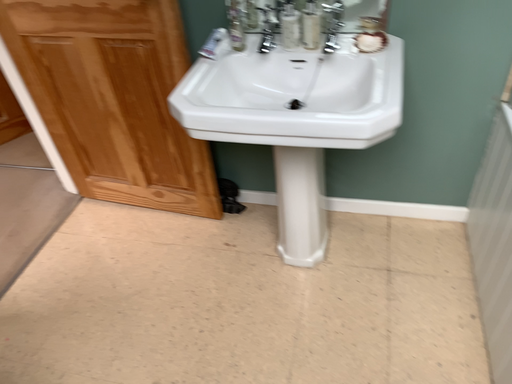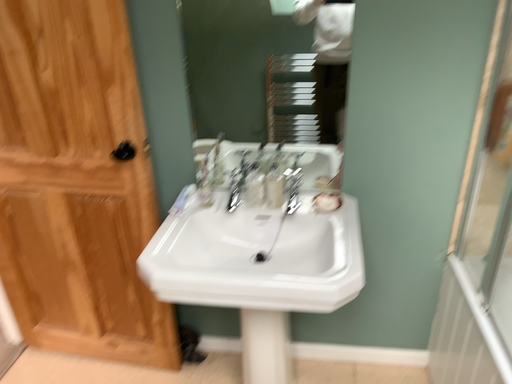
Question: Which way did the camera rotate in the video?

Choices:
 (A) rotated right
 (B) rotated left

Answer: (A)